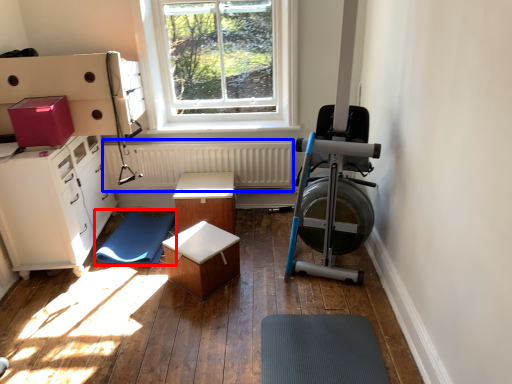
Question: Which point is closer to the camera, mat (highlighted by a red box) or radiator (highlighted by a blue box)?

Choices:
 (A) mat
 (B) radiator

Answer: (A)